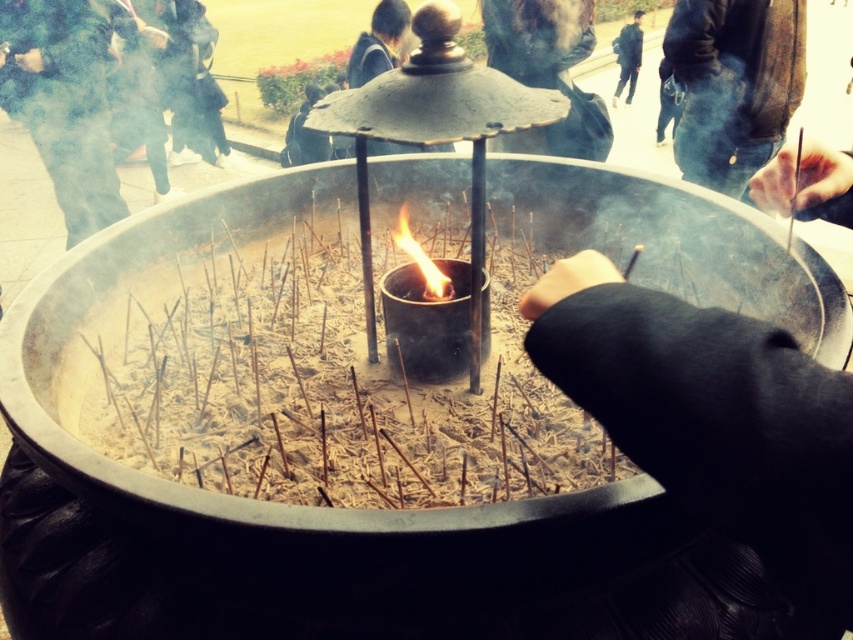
Based on the scene, which object takes up more area in the image between the charcoal ash at center and the dark blue jacket at upper center?

The dark blue jacket at upper center takes up more area in the image than the charcoal ash at center because the charcoal ash at center occupies less space than dark blue jacket at upper center.

You are standing in front of the large circular incense burner and notice the dark brown leather jacket at upper right and the flameliquidfire at center. Which object is positioned higher in the image?

The dark brown leather jacket at upper right is located above the flameliquidfire at center, so it is positioned higher in the image.

You are trying to determine the spatial relationship between the charcoal ash at center and the dark blue jacket at upper center in the image. Which object occupies a wider area in the scene?

The charcoal ash at center has a larger width than the dark blue jacket at upper center, so it occupies a wider area in the scene.